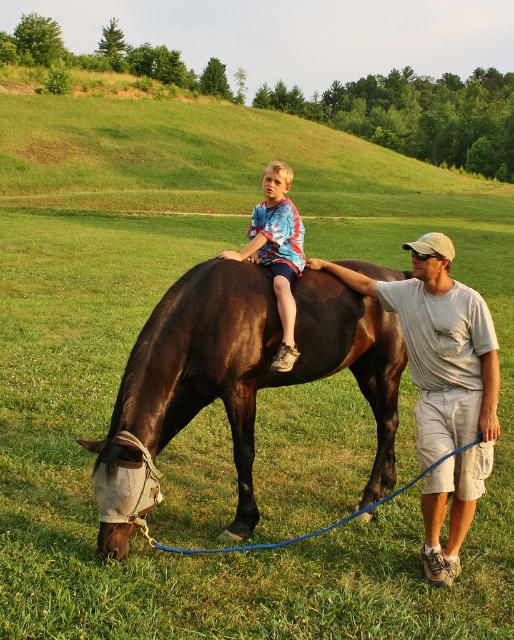
You are a photographer trying to capture the shiny dark brown horse at center. Based on the coordinates provided in the description, where should you position your camera to ensure the horse is centered in your shot?

To center the shiny dark brown horse at center in your shot, position your camera at the coordinates provided in the description, which are point (248, 365).